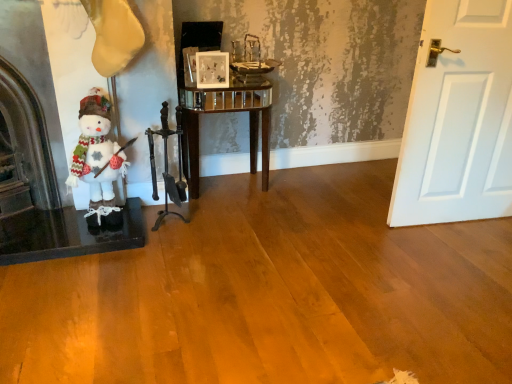
Where is `empty space that is to the right of glossy wood side table at center`? empty space that is to the right of glossy wood side table at center is located at coordinates (293, 193).